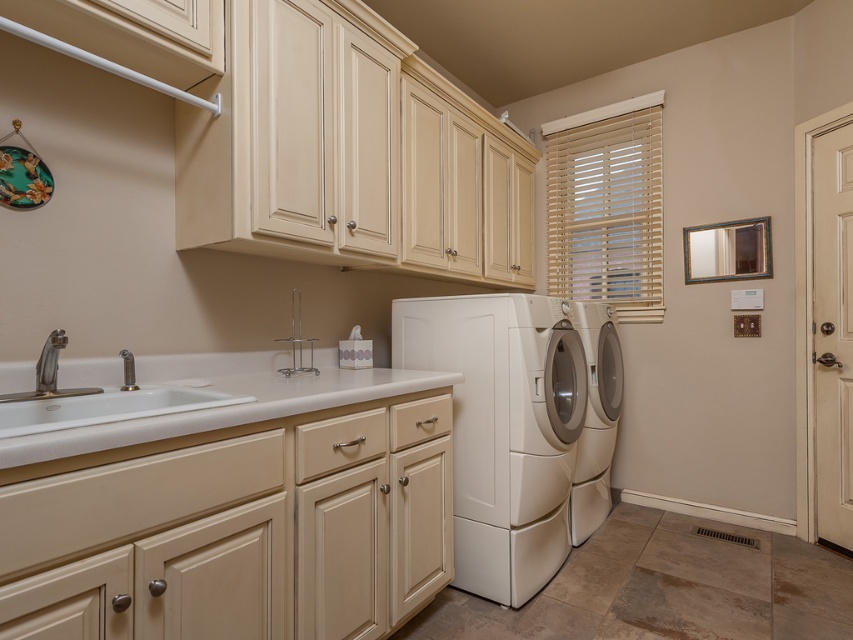
You are organizing the laundry room and need to place a large laundry basket. Which object, the white laminate countertop at lower left or the white laminate counter at lower left, has enough space to accommodate the basket?

The white laminate countertop at lower left is larger in size than the white laminate counter at lower left, so it has enough space to accommodate the basket.

Looking at this image, you are standing in the laundry room and want to move from the sink to the decorative plate on the wall. There are two points marked in the scene, point A at coordinates point A is point (393, 490) and point B is point (126, 426). Which point should you pass through first?

Point B at coordinates point (126, 426) should be passed through first because point A at coordinates point (393, 490) is behind point B.